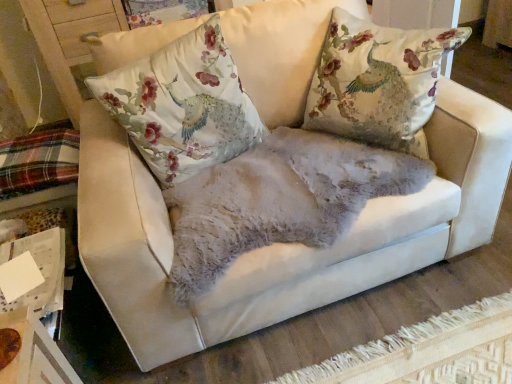
Question: From a real-world perspective, is silk floral cushion at center on top of plaid fabric at lower left?

Choices:
 (A) yes
 (B) no

Answer: (A)

Question: Are silk floral cushion at center and plaid fabric at lower left far apart?

Choices:
 (A) yes
 (B) no

Answer: (B)

Question: Is silk floral cushion at center facing towards plaid fabric at lower left?

Choices:
 (A) no
 (B) yes

Answer: (A)

Question: Is silk floral cushion at center next to plaid fabric at lower left?

Choices:
 (A) no
 (B) yes

Answer: (A)

Question: From the image's perspective, does silk floral cushion at center appear higher than plaid fabric at lower left?

Choices:
 (A) no
 (B) yes

Answer: (B)

Question: From a real-world perspective, is silk floral cushion at center below plaid fabric at lower left?

Choices:
 (A) yes
 (B) no

Answer: (B)

Question: From a real-world perspective, is plaid fabric at lower left positioned under silk floral cushion at center based on gravity?

Choices:
 (A) yes
 (B) no

Answer: (A)

Question: From the image's perspective, would you say plaid fabric at lower left is shown under silk floral cushion at center?

Choices:
 (A) yes
 (B) no

Answer: (A)

Question: Is silk floral cushion at center completely or partially inside plaid fabric at lower left?

Choices:
 (A) no
 (B) yes

Answer: (A)

Question: Is plaid fabric at lower left oriented away from silk floral cushion at center?

Choices:
 (A) yes
 (B) no

Answer: (B)

Question: From a real-world perspective, is plaid fabric at lower left on silk floral cushion at center?

Choices:
 (A) no
 (B) yes

Answer: (A)

Question: From the image's perspective, would you say plaid fabric at lower left is positioned over silk floral cushion at center?

Choices:
 (A) no
 (B) yes

Answer: (A)

Question: In terms of width, does silk floral cushion at center look wider or thinner when compared to plaid fabric at lower left?

Choices:
 (A) wide
 (B) thin

Answer: (B)